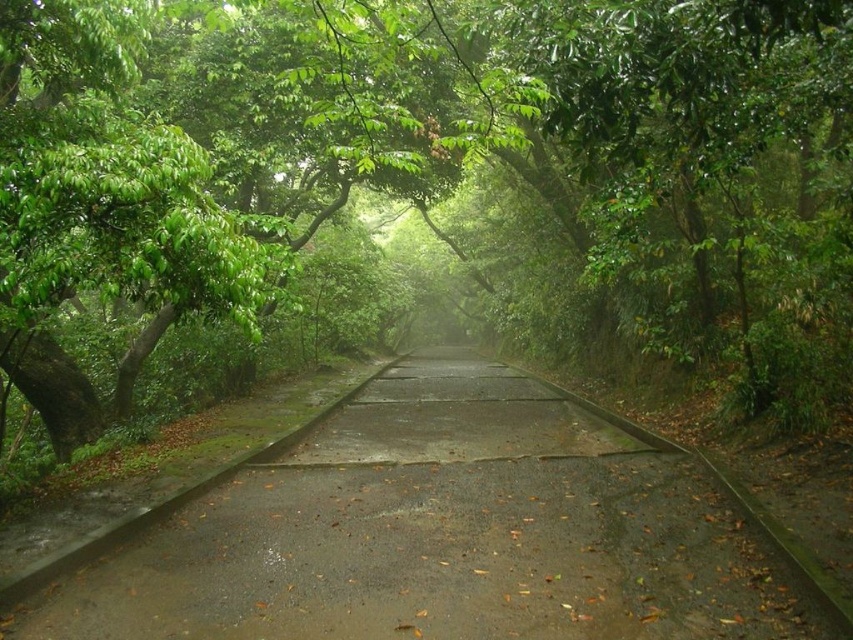
You are standing at the start of the pathway and want to walk towards the misty horizon. There is a green leafy tree at center in your way. Based on its position, will you have to detour around it or can you walk straight ahead?

The green leafy tree at center is located at coordinates (456, 150), which is directly in the center of the path. Since it is positioned right in the middle, you will need to detour around it to continue towards the misty horizon.

You are a hiker standing on the concrete road at center. Looking ahead, you see the green leafy tree at center. Which object is taller?

The green leafy tree at center is much taller than the concrete road at center.